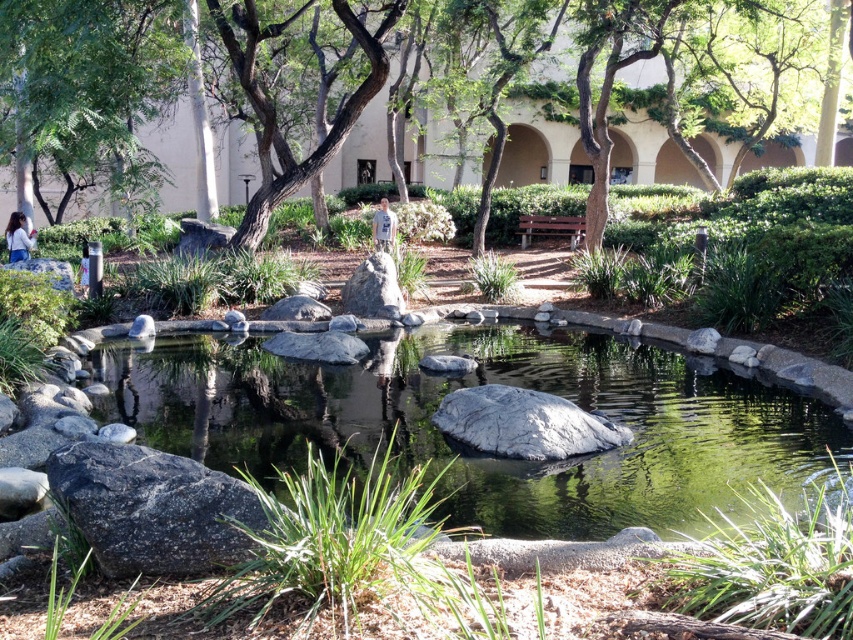
Question: Among these objects, which one is nearest to the camera?

Choices:
 (A) green leafy tree at upper left
 (B) gray rough rock at center

Answer: (A)

Question: Which object is closer to the camera taking this photo?

Choices:
 (A) gray rough rock at center
 (B) green leafy tree at upper left
 (C) smooth gray rock at center
 (D) green leafy tree at center

Answer: (C)

Question: Is green leafy tree at center below green leafy tree at upper left?

Choices:
 (A) no
 (B) yes

Answer: (A)

Question: In this image, where is smooth gray rock at center located relative to brown rough bark tree at upper center?

Choices:
 (A) right
 (B) left

Answer: (A)

Question: Which object is the farthest from the gray rough rock at center?

Choices:
 (A) green leafy tree at center
 (B) green leafy tree at upper left
 (C) smooth gray rock at center
 (D) gray rough rock at lower left

Answer: (D)

Question: Is smooth gray rock at center wider than gray rough rock at lower left?

Choices:
 (A) yes
 (B) no

Answer: (B)